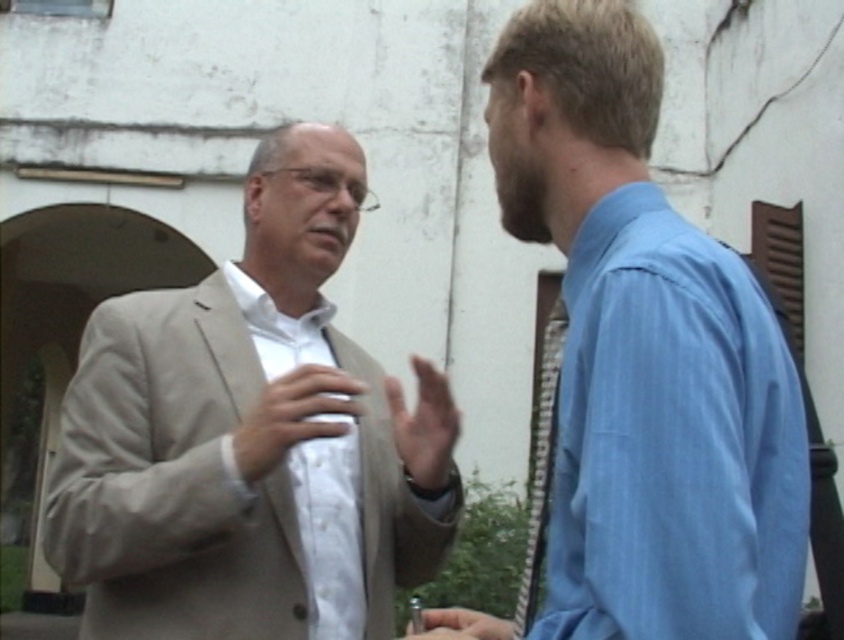
Question: Is light beige suit at center positioned before blue cotton shirt at right?

Choices:
 (A) yes
 (B) no

Answer: (B)

Question: Which point is closer to the camera?

Choices:
 (A) (604, 320)
 (B) (375, 483)

Answer: (A)

Question: Does light beige suit at center have a lesser width compared to white smooth shirt at center?

Choices:
 (A) yes
 (B) no

Answer: (B)

Question: From the image, what is the correct spatial relationship of light beige suit at center in relation to white smooth shirt at center?

Choices:
 (A) below
 (B) above

Answer: (B)

Question: Estimate the real-world distances between objects in this image. Which object is farther from the blue cotton shirt at right?

Choices:
 (A) white smooth shirt at center
 (B) light beige suit at center

Answer: (A)

Question: Which object is farther from the camera taking this photo?

Choices:
 (A) blue cotton shirt at right
 (B) white smooth shirt at center
 (C) light beige suit at center

Answer: (B)